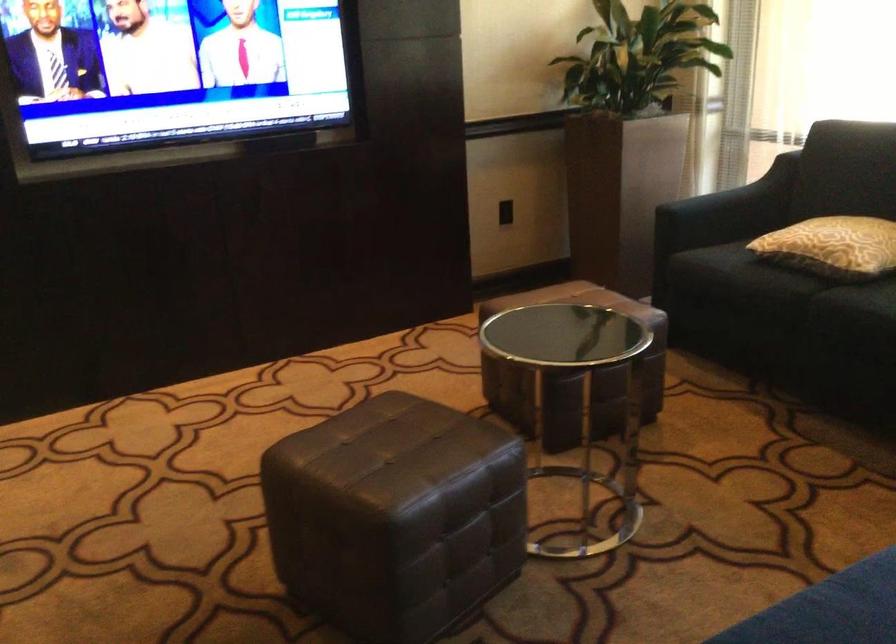
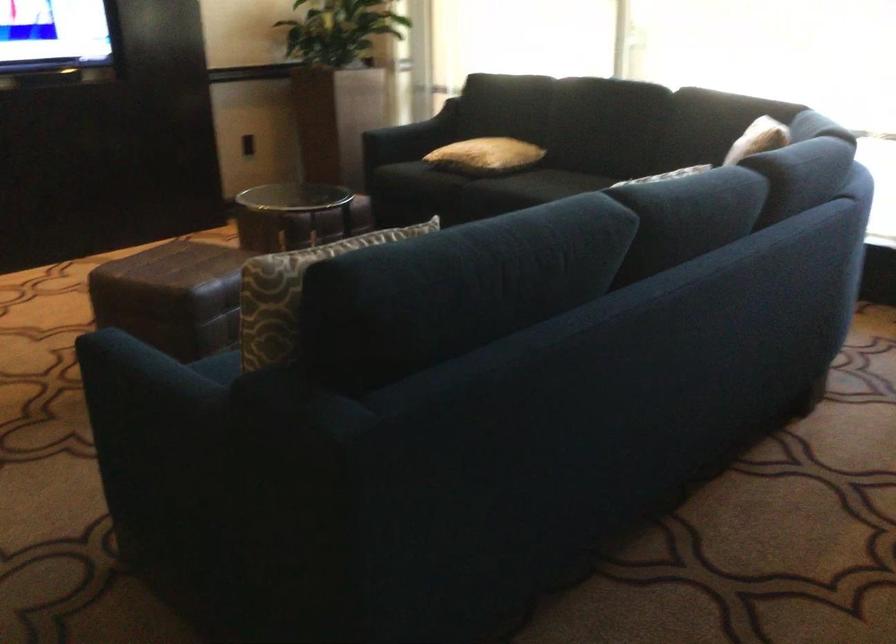
Question: Which direction would the cameraman need to move to produce the second image? Reply with the corresponding letter.

Choices:
 (A) Left
 (B) Right
 (C) Forward
 (D) Backward

Answer: (D)